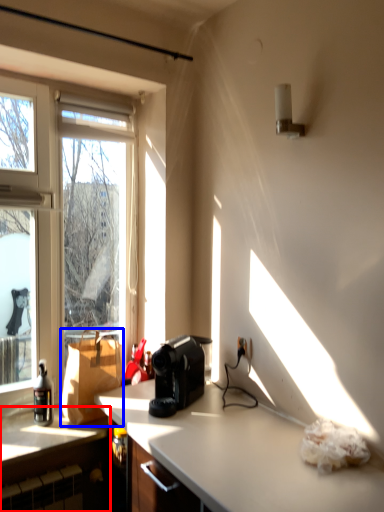
Question: Which point is closer to the camera, cabinetry (highlighted by a red box) or cardboard box (highlighted by a blue box)?

Choices:
 (A) cabinetry
 (B) cardboard box

Answer: (A)